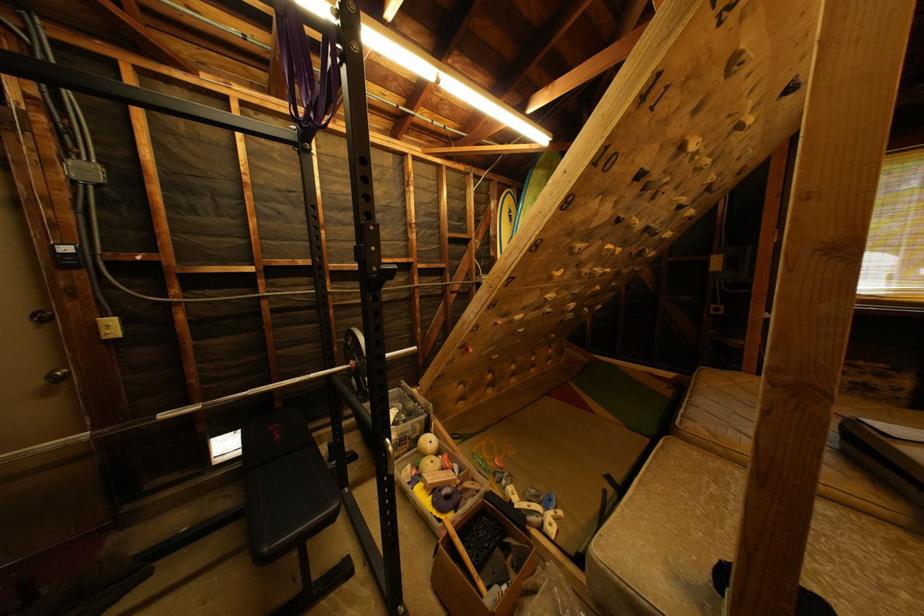
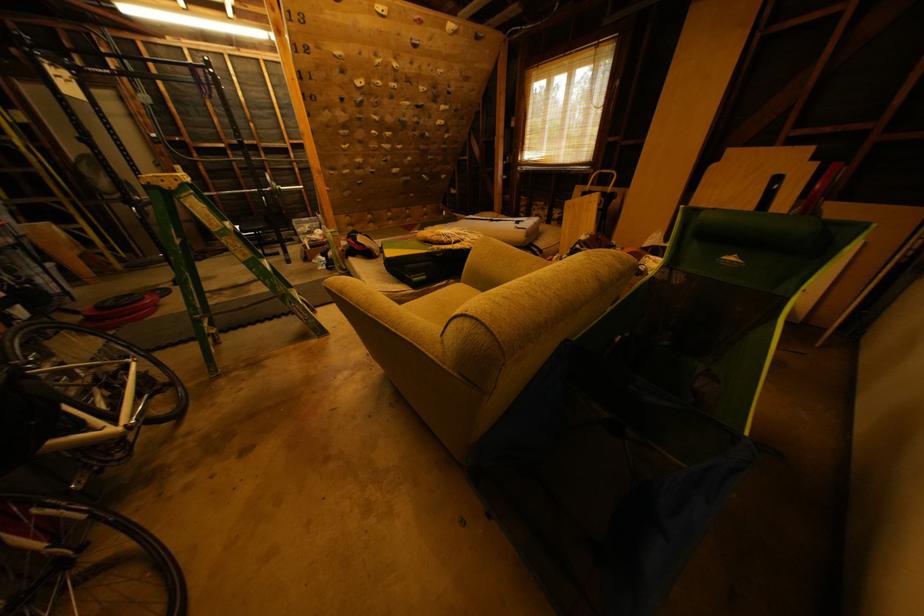
The images are taken continuously from a first-person perspective. In which direction are you moving?

The cameraman walked toward right, backward.